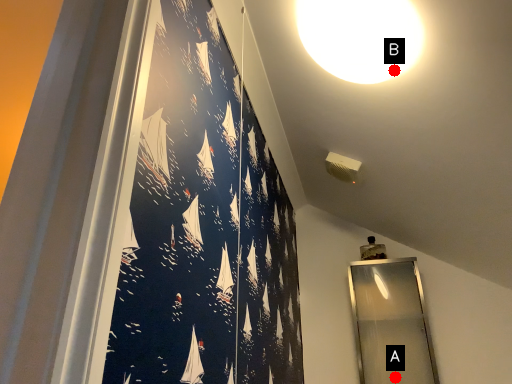
Question: Two points are circled on the image, labeled by A and B beside each circle. Which point is further to the camera?

Choices:
 (A) A is further
 (B) B is further

Answer: (A)